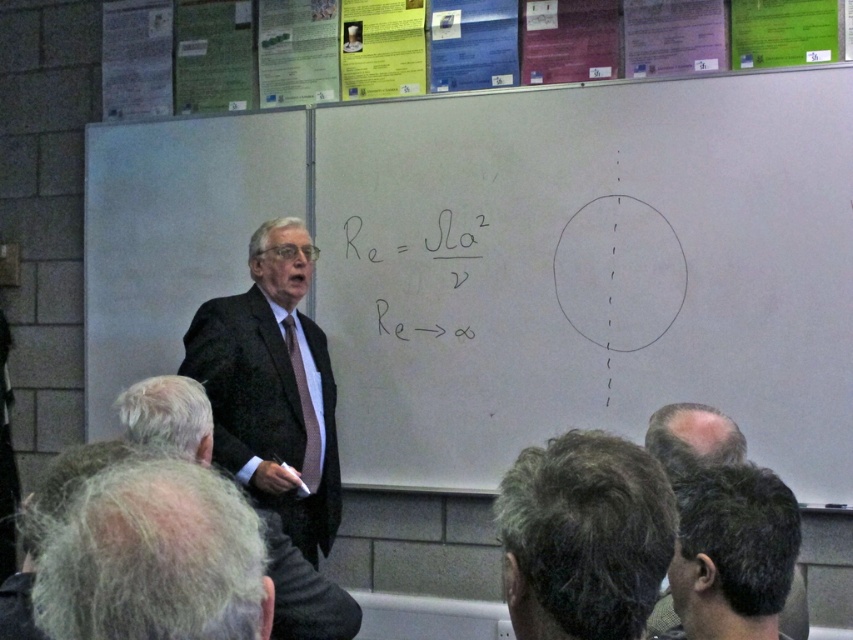
Question: Observing the image, what is the correct spatial positioning of dark brown hair at lower center in reference to gray hair at lower right?

Choices:
 (A) left
 (B) right

Answer: (A)

Question: Estimate the real-world distances between objects in this image. Which object is farther from the whiteboard at center?

Choices:
 (A) brown striped tie at center
 (B) gray hair at lower left
 (C) gray hair at lower right

Answer: (B)

Question: Does gray hair at lower left appear under black matte text at center?

Choices:
 (A) no
 (B) yes

Answer: (B)

Question: Which point is farther to the camera?

Choices:
 (A) (576, 442)
 (B) (294, 305)
 (C) (746, 374)

Answer: (B)

Question: Is dark brown hair at lower center smaller than black matte text at center?

Choices:
 (A) yes
 (B) no

Answer: (A)

Question: Which of the following is the closest to the observer?

Choices:
 (A) whiteboard at center
 (B) gray hair at lower right
 (C) brown striped tie at center
 (D) dark brown hair at lower center

Answer: (D)